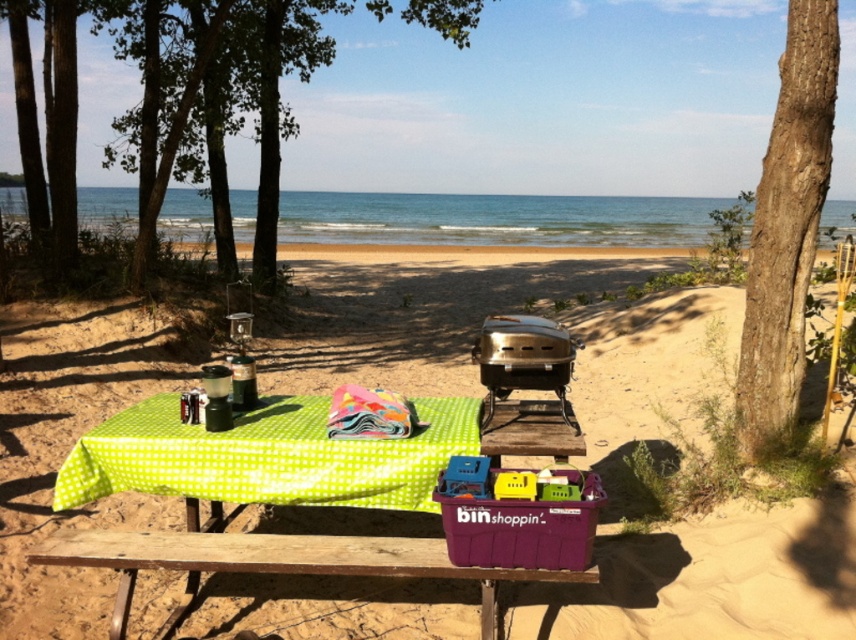
You are a photographer setting up a shot of the beach picnic scene. You need to position yourself so that the green leafy tree at left and the multicolored fabric at center are both in frame. Which object should you focus on first to ensure both are in the shot?

You should focus on the green leafy tree at left first because it is closer to you than the multicolored fabric at center, so by framing it first, you can adjust the camera to include both objects in the shot.

From the picture: You are standing at the beach and want to place a new bench between the green checkered picnic table at center and the brown rough bark tree at right. If the bench is 1.5 meters long, will it fit between them?

The green checkered picnic table at center is closer to the viewer than the brown rough bark tree at right, so the distance between them is more than 1.5 meters. Therefore, the bench will fit between them.